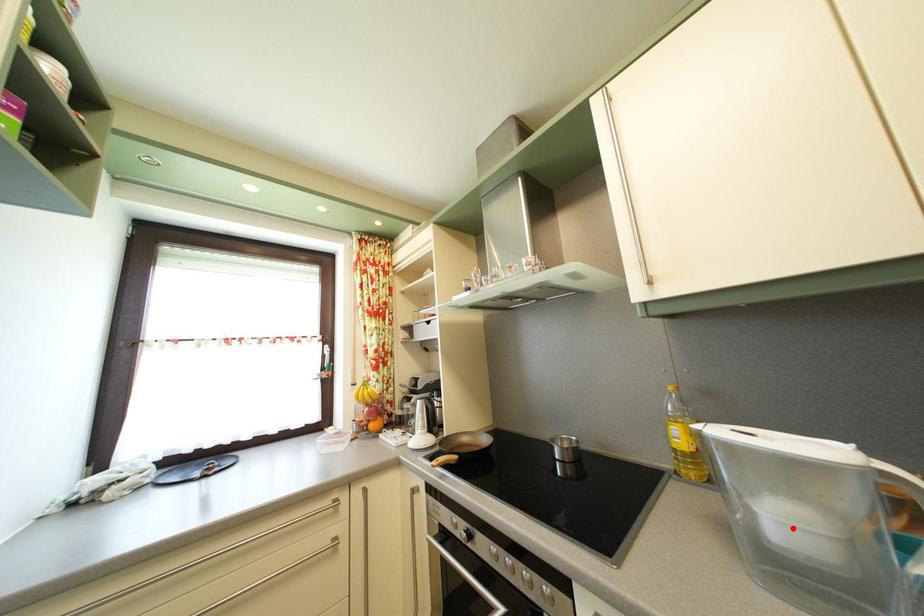
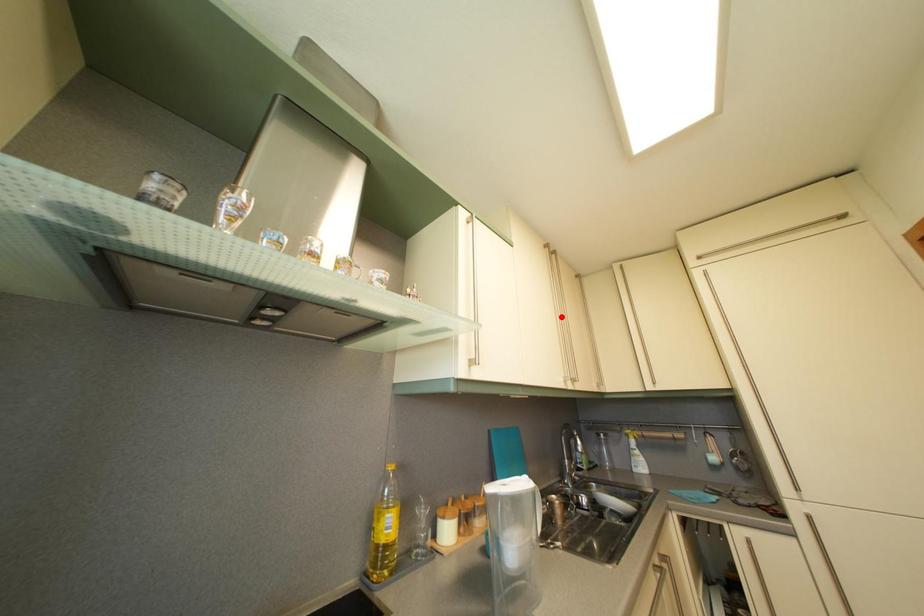
From the picture: I am providing you with two images of the same scene from different viewpoints. A red point is marked on the first image and another point is marked on the second image. Are the points marked in image1 and image2 representing the same 3D position?

No